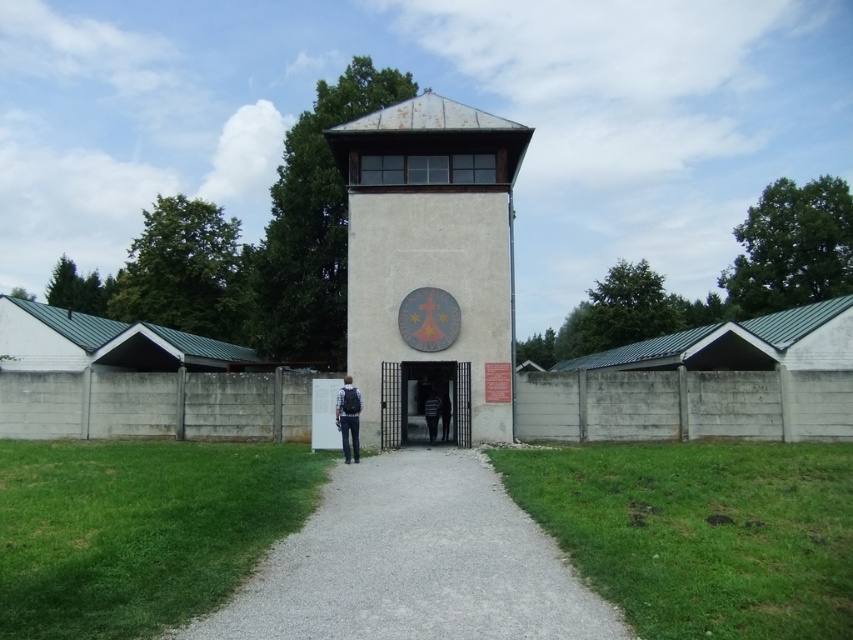
Question: Estimate the real-world distances between objects in this image. Which object is farther from the smooth concrete gate at center?

Choices:
 (A) denim jacket at center
 (B) striped fabric jacket at center
 (C) gray gravel path at center

Answer: (C)

Question: Does beige concrete tower at center appear on the right side of striped fabric jacket at center?

Choices:
 (A) yes
 (B) no

Answer: (B)

Question: Is beige concrete tower at center bigger than smooth concrete gate at center?

Choices:
 (A) yes
 (B) no

Answer: (A)

Question: Which point appears farthest from the camera in this image?

Choices:
 (A) (492, 365)
 (B) (432, 403)
 (C) (448, 424)
 (D) (363, 557)

Answer: (B)

Question: Which of these objects is positioned farthest from the gray gravel path at center?

Choices:
 (A) beige concrete tower at center
 (B) smooth concrete gate at center
 (C) striped fabric jacket at center

Answer: (A)

Question: Is beige concrete tower at center bigger than denim jacket at center?

Choices:
 (A) no
 (B) yes

Answer: (B)